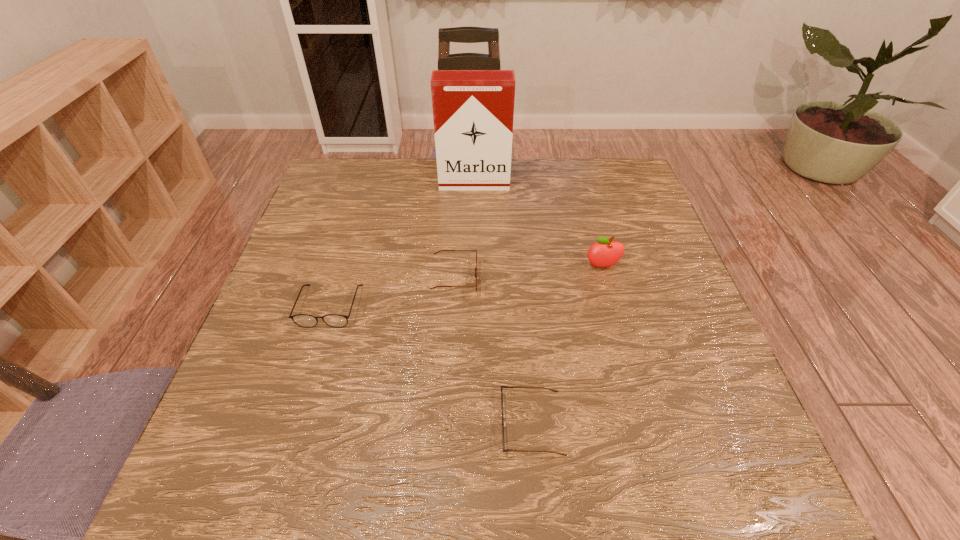
Locate an element on the screen. This screenshot has height=540, width=960. free spot between the apple and the second spectacles from right to left is located at coordinates (529, 273).

The width and height of the screenshot is (960, 540). Find the location of `vacant space that is in between the second spectacles from left to right and the leftmost spectacles`. vacant space that is in between the second spectacles from left to right and the leftmost spectacles is located at coordinates (393, 293).

Identify the location of object that is the third closest to the second spectacles from right to left. (605, 253).

You are a GUI agent. You are given a task and a screenshot of the screen. Output one action in this format:
    pyautogui.click(x=<x>, y=<y>)
    Task: Click on the object that is the fourth closest to the tallest object
    This screenshot has height=540, width=960.
    Given the screenshot: What is the action you would take?
    pyautogui.click(x=503, y=423)

This screenshot has width=960, height=540. Find the location of `spectacles that can be found as the closest to the shortest spectacles`. spectacles that can be found as the closest to the shortest spectacles is located at coordinates (440, 250).

Locate which spectacles ranks second in proximity to the leftmost object. Please provide its 2D coordinates. Your answer should be formatted as a tuple, i.e. [(x, y)], where the tuple contains the x and y coordinates of a point satisfying the conditions above.

[(503, 423)]

At what (x,y) coordinates should I click in order to perform the action: click on vacant region that satisfies the following two spatial constraints: 1. on the front-facing side of the rightmost object; 2. on the right side of the cigarette_case. Please return your answer as a coordinate pair (x, y). This screenshot has width=960, height=540. Looking at the image, I should click on (473, 266).

Where is `free point that satisfies the following two spatial constraints: 1. at the front view of the second spectacles from right to left; 2. on the front-facing side of the leftmost object`? The height and width of the screenshot is (540, 960). free point that satisfies the following two spatial constraints: 1. at the front view of the second spectacles from right to left; 2. on the front-facing side of the leftmost object is located at coordinates (453, 306).